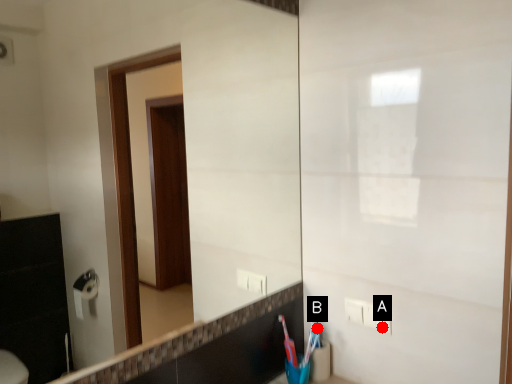
Question: Two points are circled on the image, labeled by A and B beside each circle. Which of the following is the farthest from the observer?

Choices:
 (A) A is further
 (B) B is further

Answer: (B)